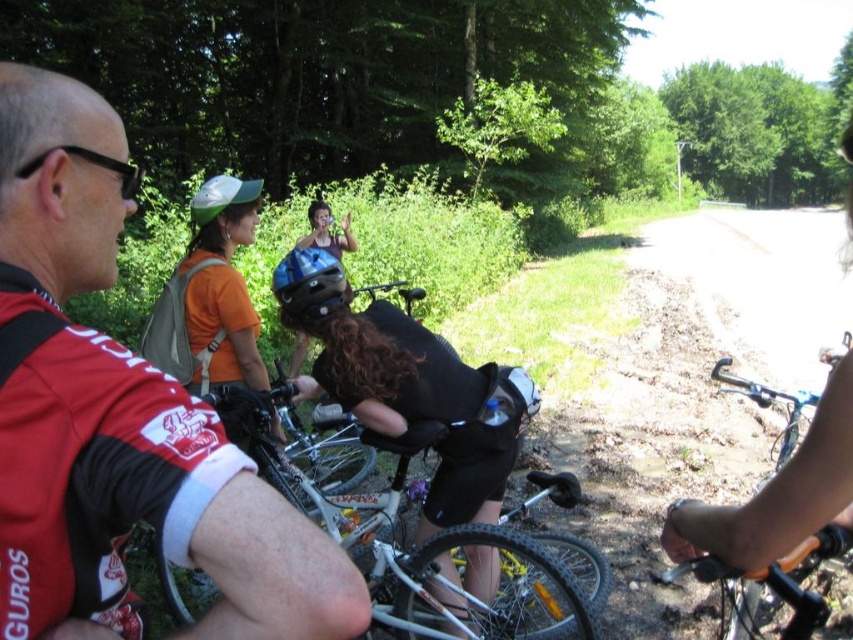
Question: Can you confirm if silver metallic bicycle at center is positioned above blue matte helmet at center?

Choices:
 (A) no
 (B) yes

Answer: (A)

Question: Among these objects, which one is farthest from the camera?

Choices:
 (A) blue matte helmet at center
 (B) silver metallic bicycle at center

Answer: (A)

Question: Is matte black helmet at center positioned before silver metallic bicycle at center?

Choices:
 (A) yes
 (B) no

Answer: (B)

Question: Does matte black helmet at center appear under silver metallic bicycle at center?

Choices:
 (A) yes
 (B) no

Answer: (B)

Question: Which point is farther to the camera?

Choices:
 (A) blue matte helmet at center
 (B) matte black helmet at center

Answer: (A)

Question: Estimate the real-world distances between objects in this image. Which object is closer to the blue matte helmet at center?

Choices:
 (A) silver metallic bicycle at center
 (B) red jersey at center

Answer: (A)